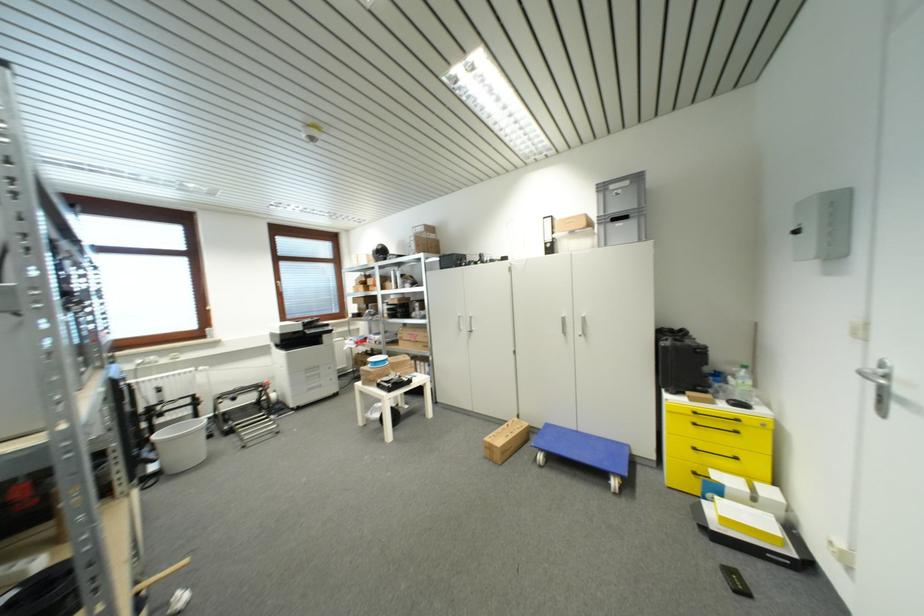
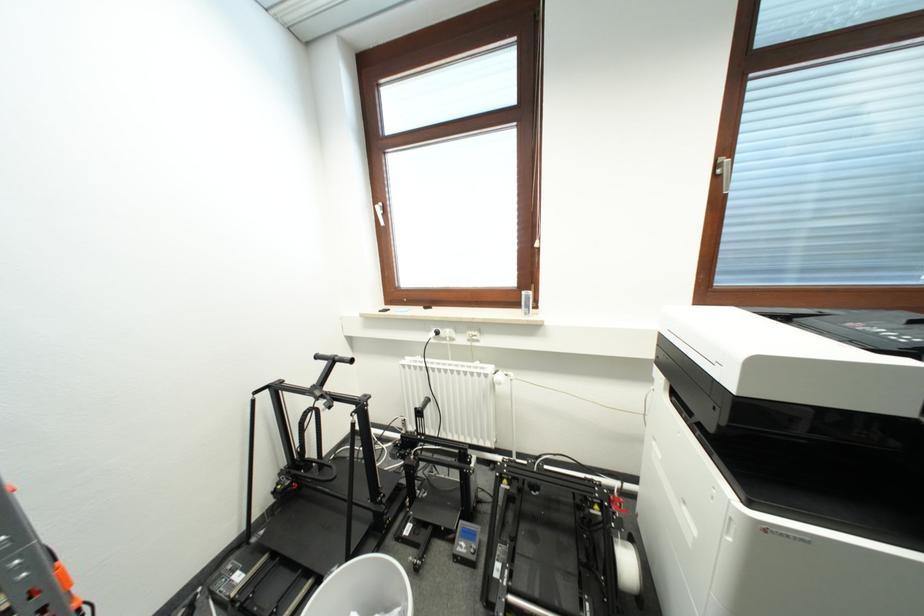
In the second image, find the point that corresponds to point (287, 267) in the first image.

(766, 89)